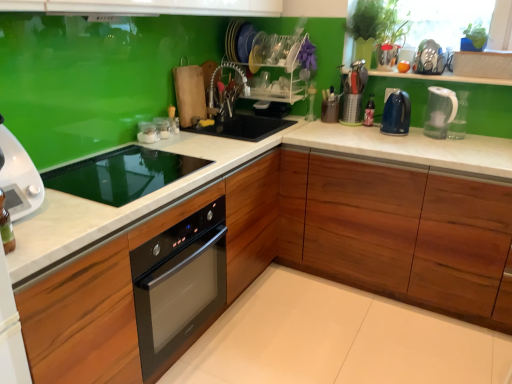
Find the location of a particular element. The width and height of the screenshot is (512, 384). vacant space that is to the left of clear plastic bottle at center, the 1th bottle when ordered from right to left is located at coordinates (347, 125).